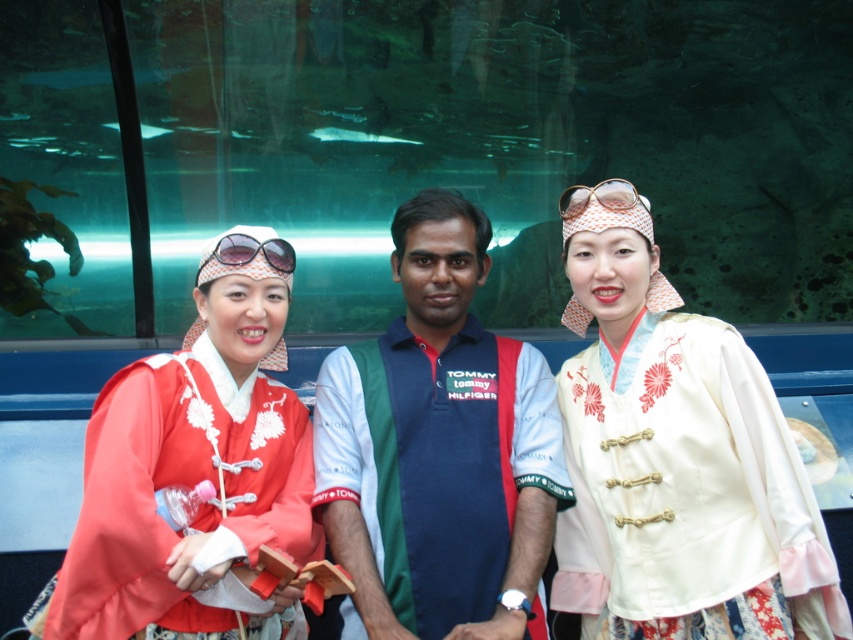
Question: Does white satin blouse at center have a lesser width compared to sunglasses at center?

Choices:
 (A) yes
 (B) no

Answer: (B)

Question: Is white satin blouse at center above sunglasses at center?

Choices:
 (A) yes
 (B) no

Answer: (B)

Question: Among these objects, which one is nearest to the camera?

Choices:
 (A) sunglasses at center
 (B) matte red kimono at center

Answer: (B)

Question: Does blue cotton shirt at center appear under sunglasses at center?

Choices:
 (A) no
 (B) yes

Answer: (B)

Question: Based on their relative distances, which object is nearer to the matte red kimono at center?

Choices:
 (A) white satin blouse at center
 (B) gold textured goggles at center
 (C) matte red kimono at left

Answer: (C)

Question: Which of the following is the closest to the observer?

Choices:
 (A) (149, 554)
 (B) (339, 358)

Answer: (A)